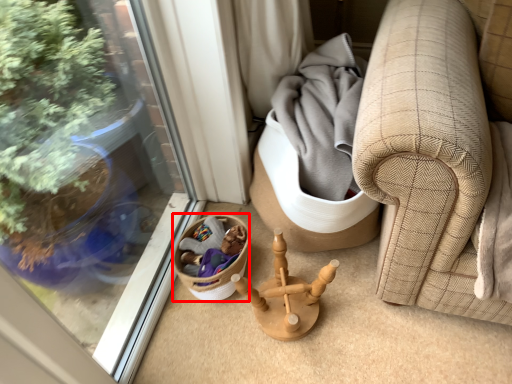
Question: From the image's perspective, what is the correct spatial relationship of basket (annotated by the red box) in relation to miniature?

Choices:
 (A) above
 (B) below

Answer: (A)